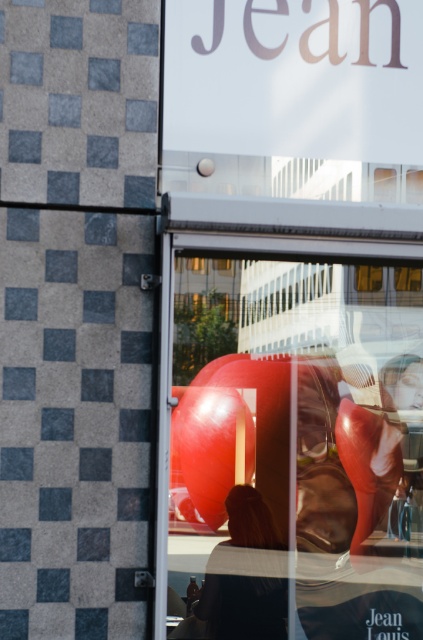
Is glossy red sculpture at center positioned at the back of blonde hair at center?

That is False.

Describe the element at coordinates (293, 444) in the screenshot. I see `glossy red sculpture at center` at that location.

You are a GUI agent. You are given a task and a screenshot of the screen. Output one action in this format:
    pyautogui.click(x=<x>, y=<y>)
    Task: Click on the glossy red sculpture at center
    The height and width of the screenshot is (640, 423).
    Given the screenshot: What is the action you would take?
    pos(293,444)

This screenshot has width=423, height=640. I want to click on glossy red sculpture at center, so click(293, 444).